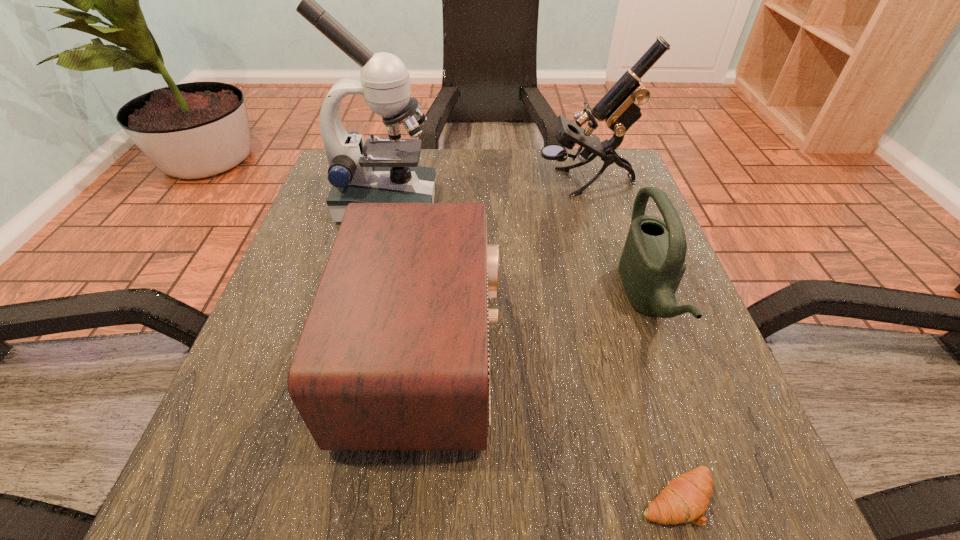
This screenshot has height=540, width=960. What are the coordinates of `the left microscope` in the screenshot? It's located at (383, 170).

This screenshot has height=540, width=960. I want to click on the tallest object, so click(383, 170).

This screenshot has width=960, height=540. I want to click on the shorter microscope, so click(619, 108).

Locate an element on the screen. the right microscope is located at coordinates (619, 108).

Where is `radio receiver`? The width and height of the screenshot is (960, 540). radio receiver is located at coordinates (394, 355).

This screenshot has height=540, width=960. Identify the location of watering can. (652, 264).

Where is `the nearest object`? This screenshot has width=960, height=540. the nearest object is located at coordinates (685, 499).

Where is `the shortest object`? This screenshot has width=960, height=540. the shortest object is located at coordinates (685, 499).

Locate an element on the screen. The height and width of the screenshot is (540, 960). blank space located 0.370m on the front of the left microscope is located at coordinates (342, 377).

Locate an element on the screen. The image size is (960, 540). free location located 0.220m through the eyepiece of the fourth shortest object is located at coordinates (445, 183).